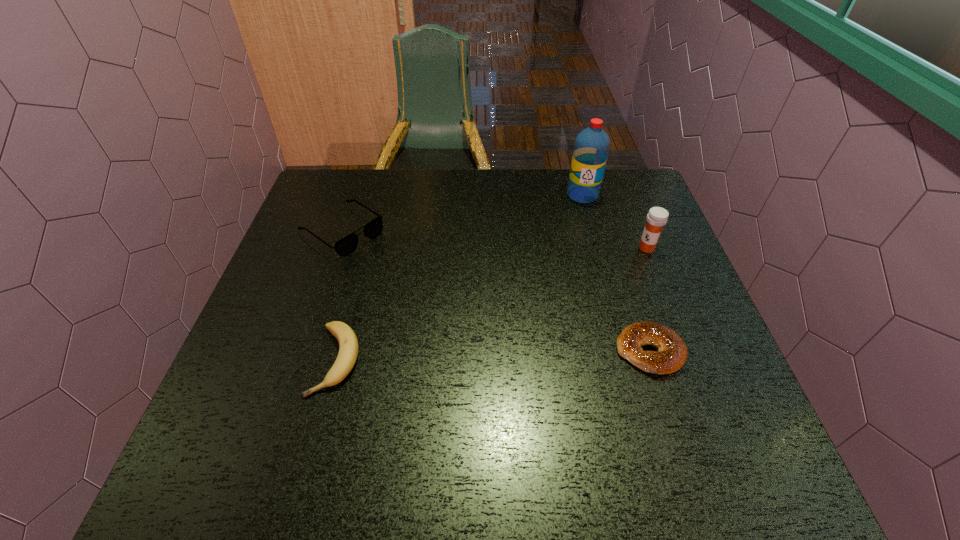
The image size is (960, 540). In order to click on free space located on the label side of the fourth shortest object in this screenshot , I will do `click(620, 267)`.

You are a GUI agent. You are given a task and a screenshot of the screen. Output one action in this format:
    pyautogui.click(x=<x>, y=<y>)
    Task: Click on the vacant region located 0.200m on the label side of the fourth shortest object
    The image size is (960, 540).
    Given the screenshot: What is the action you would take?
    tap(592, 288)

You are a GUI agent. You are given a task and a screenshot of the screen. Output one action in this format:
    pyautogui.click(x=<x>, y=<y>)
    Task: Click on the vacant space located on the label side of the fourth shortest object
    Image resolution: width=960 pixels, height=540 pixels.
    Given the screenshot: What is the action you would take?
    pyautogui.click(x=605, y=278)

At what (x,y) coordinates should I click in order to perform the action: click on vacant region located on the front label of the tallest object. Please return your answer as a coordinate pair (x, y). This screenshot has height=540, width=960. Looking at the image, I should click on (553, 278).

At what (x,y) coordinates should I click in order to perform the action: click on vacant space situated on the front label of the tallest object. Please return your answer as a coordinate pair (x, y). Looking at the image, I should click on (563, 251).

Identify the location of vacant space located on the front label of the tallest object. The width and height of the screenshot is (960, 540). (546, 298).

Identify the location of spectacles that is at the far edge. The width and height of the screenshot is (960, 540). (345, 246).

This screenshot has width=960, height=540. I want to click on water bottle located in the far edge section of the desktop, so click(591, 148).

Locate an element on the screen. This screenshot has height=540, width=960. object that is at the near edge is located at coordinates (348, 344).

Identify the location of banana present at the left edge. The image size is (960, 540). (348, 344).